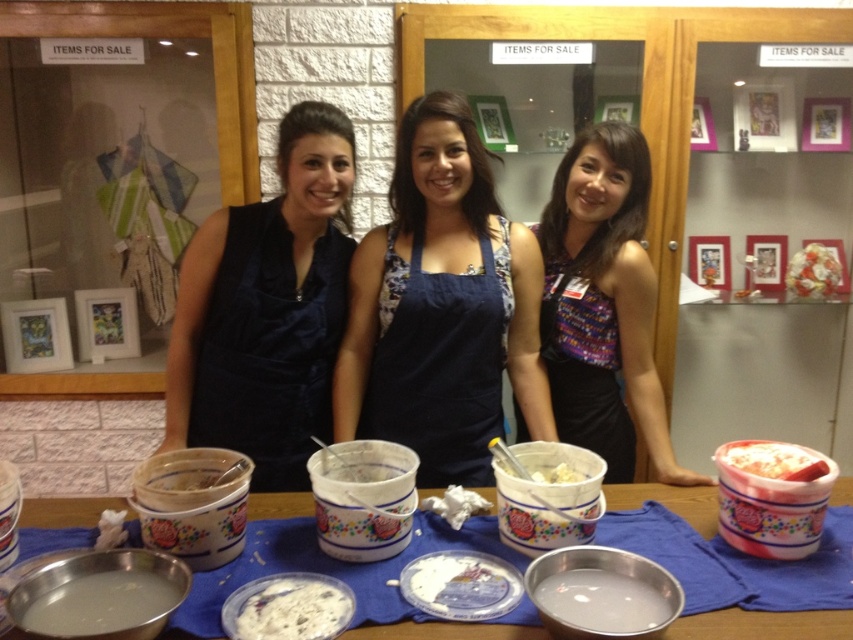
You are a customer at a craft fair and see the table with items for sale. You notice a point at coordinates [584,392] on the table. What object is located at that point?

The point at coordinates [584,392] corresponds to the patterned fabric apron at center.

You are at a craft fair and need to locate two specific points marked on the image. The first point is at coordinate point(595,435) and the second is at point(293,621). From your current position, which point is closer to you?

Point(293,621) is closer to you because it is in front of point(595,435).